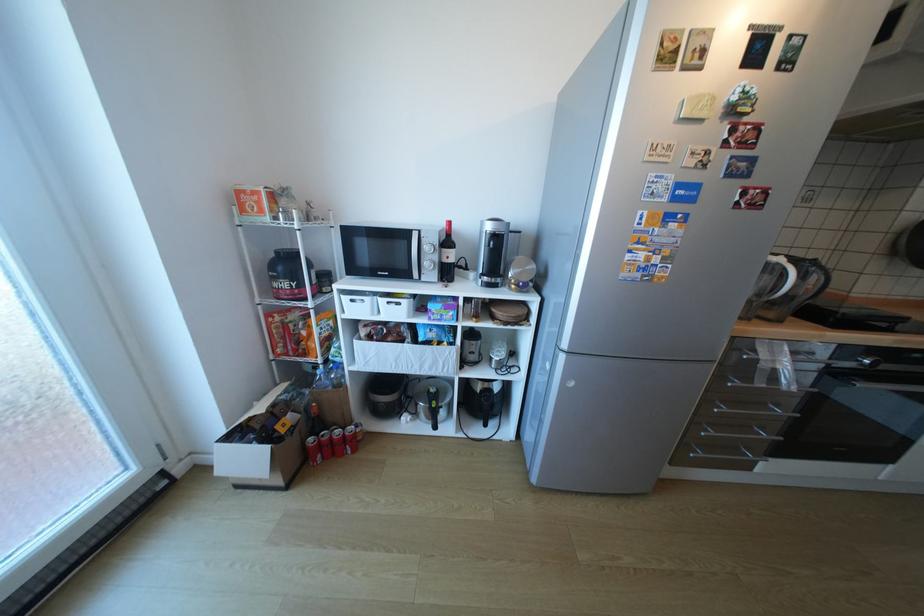
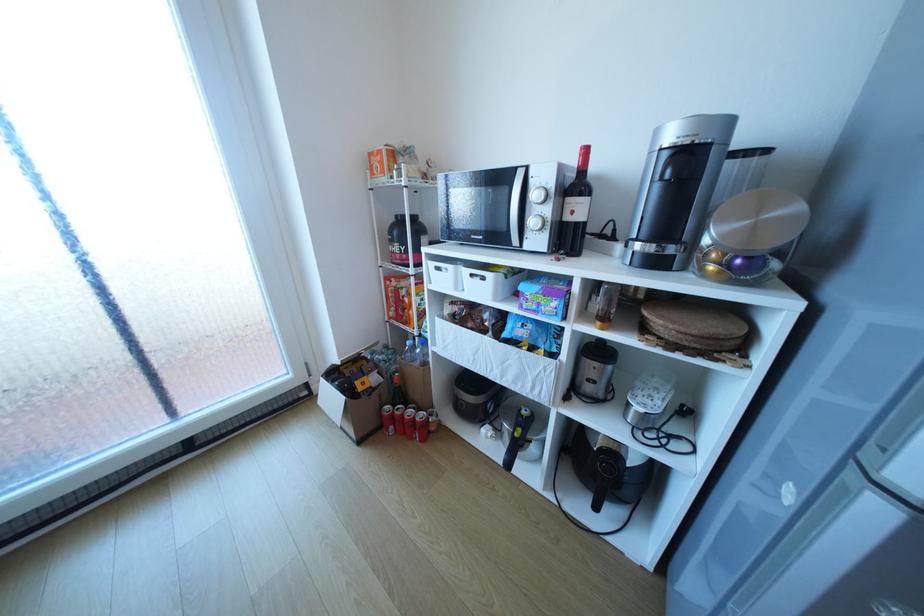
Where in the second image is the point corresponding to [434,248] from the first image?

(542, 195)